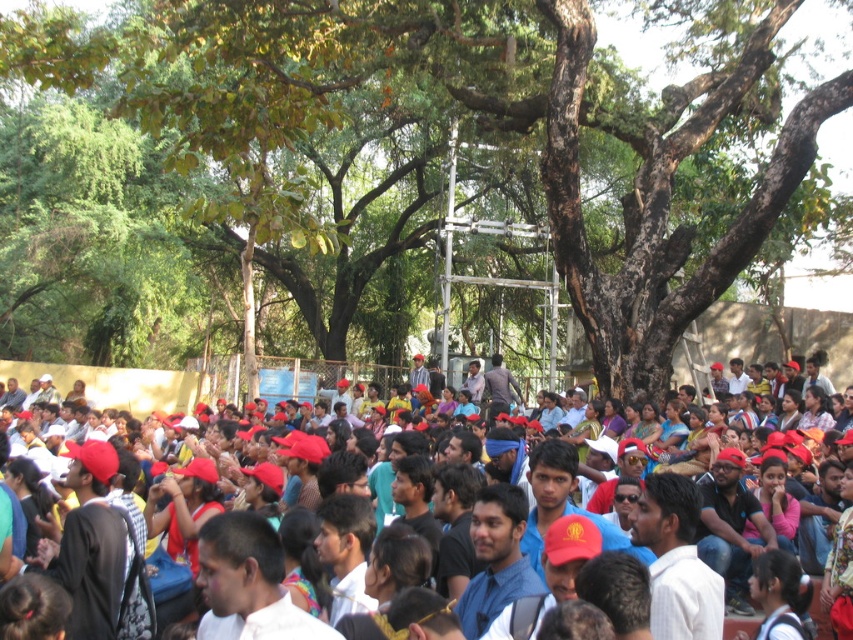
Question: Which point appears closest to the camera in this image?

Choices:
 (A) (103, 68)
 (B) (730, 433)

Answer: (B)

Question: Which point is closer to the camera?

Choices:
 (A) red matte cap at center
 (B) brown rough tree at center

Answer: (A)

Question: In this image, where is brown rough tree at center located relative to red matte cap at center?

Choices:
 (A) right
 (B) left

Answer: (B)

Question: Is brown rough tree at center to the right of red matte cap at center from the viewer's perspective?

Choices:
 (A) yes
 (B) no

Answer: (B)

Question: Can you confirm if brown rough tree at center is positioned to the left of red matte cap at center?

Choices:
 (A) yes
 (B) no

Answer: (A)